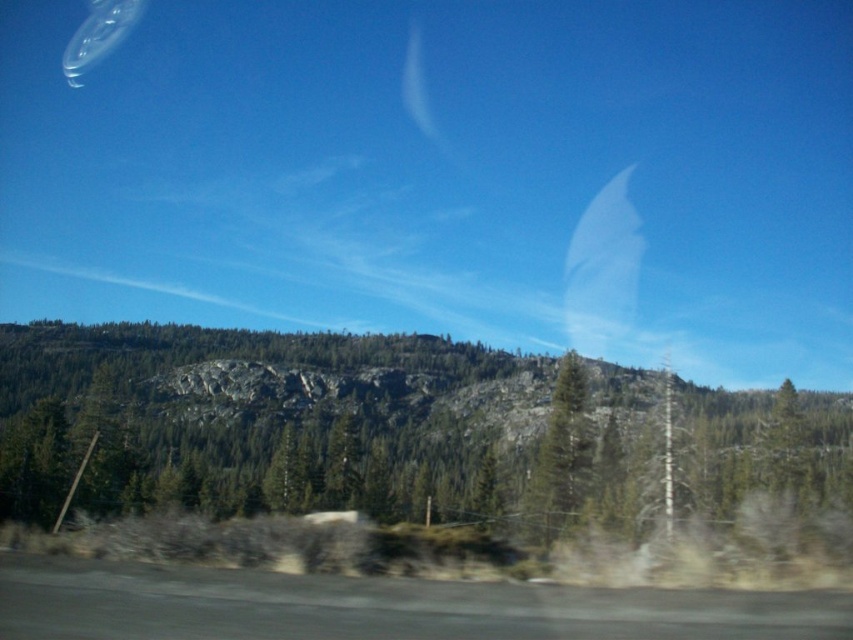
Is point (485, 492) positioned behind point (546, 545)?

Yes, point (485, 492) is farther from viewer.

Between point (509, 468) and point (576, 467), which one is positioned behind?

The point (509, 468) is more distant.

Between point (312, 401) and point (573, 436), which one is positioned behind?

Positioned behind is point (312, 401).

Where is `green textured tree at center`? This screenshot has height=640, width=853. green textured tree at center is located at coordinates (310, 422).